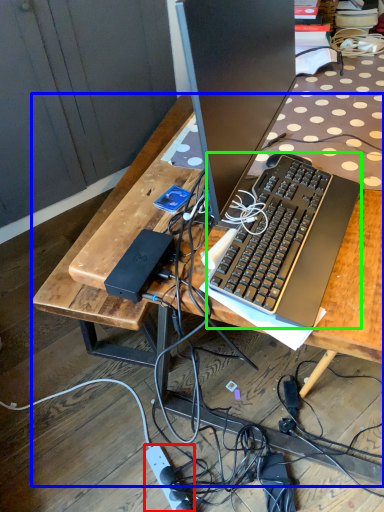
Question: Which is nearer to the power outlet (highlighted by a red box)? desk (highlighted by a blue box) or computer keyboard (highlighted by a green box).

Choices:
 (A) desk
 (B) computer keyboard

Answer: (A)